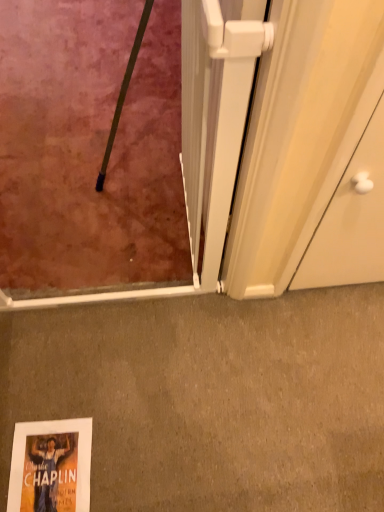
Question: From a real-world perspective, is matte gray carpet at lower center on top of white plastic screen door at center?

Choices:
 (A) no
 (B) yes

Answer: (A)

Question: Is white plastic screen door at center inside matte gray carpet at lower center?

Choices:
 (A) yes
 (B) no

Answer: (B)

Question: Is matte gray carpet at lower center wider than white plastic screen door at center?

Choices:
 (A) yes
 (B) no

Answer: (A)

Question: Is matte gray carpet at lower center oriented away from white plastic screen door at center?

Choices:
 (A) no
 (B) yes

Answer: (A)

Question: Is matte gray carpet at lower center aimed at white plastic screen door at center?

Choices:
 (A) no
 (B) yes

Answer: (B)

Question: From the image's perspective, is matte gray carpet at lower center beneath white plastic screen door at center?

Choices:
 (A) no
 (B) yes

Answer: (B)

Question: Is the position of white plastic screen door at center more distant than that of matte gray carpet at lower center?

Choices:
 (A) no
 (B) yes

Answer: (A)

Question: Does white plastic screen door at center contain matte gray carpet at lower center?

Choices:
 (A) yes
 (B) no

Answer: (B)

Question: Is white plastic screen door at center not inside matte gray carpet at lower center?

Choices:
 (A) no
 (B) yes

Answer: (B)

Question: From a real-world perspective, is white plastic screen door at center on top of matte gray carpet at lower center?

Choices:
 (A) no
 (B) yes

Answer: (B)

Question: Considering the relative sizes of white plastic screen door at center and matte gray carpet at lower center in the image provided, is white plastic screen door at center bigger than matte gray carpet at lower center?

Choices:
 (A) no
 (B) yes

Answer: (B)

Question: Is white plastic screen door at center to the right of matte gray carpet at lower center from the viewer's perspective?

Choices:
 (A) yes
 (B) no

Answer: (B)

Question: Is point (109, 336) closer or farther from the camera than point (213, 168)?

Choices:
 (A) farther
 (B) closer

Answer: (A)